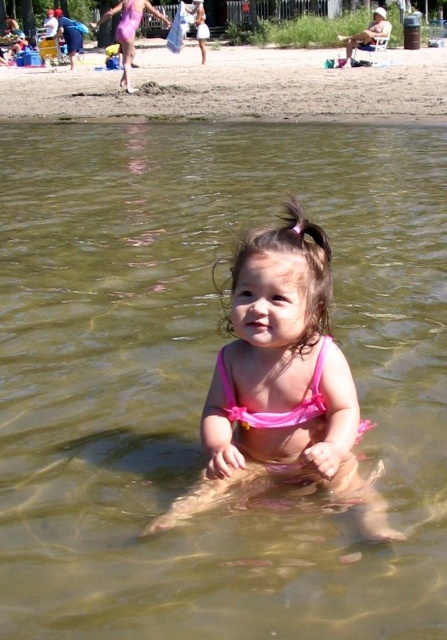
Which is below, pink fabric bikini at center or pink fabric swimsuit at center?

pink fabric swimsuit at center is lower down.

Does pink fabric bikini at center have a smaller size compared to pink fabric swimsuit at center?

Actually, pink fabric bikini at center might be larger than pink fabric swimsuit at center.

Who is more forward, (x=231, y=381) or (x=299, y=412)?

Point (x=299, y=412) is more forward.

Where is `pink fabric bikini at center`? pink fabric bikini at center is located at coordinates (281, 378).

Can you confirm if pink fabric bikini at center is positioned below brown sand at upper center?

Yes, pink fabric bikini at center is below brown sand at upper center.

Between point (312, 371) and point (154, 84), which one is positioned in front?

Point (312, 371) is in front.

The image size is (447, 640). Find the location of `pink fabric bikini at center`. pink fabric bikini at center is located at coordinates 281,378.

Who is more distant from viewer, (316, 97) or (315, 364)?

The point (316, 97) is more distant.

Which is in front, point (388, 93) or point (222, 374)?

Point (222, 374)

Does point (76, 86) come closer to viewer compared to point (282, 413)?

No, it is not.

The height and width of the screenshot is (640, 447). What are the coordinates of `brown sand at upper center` in the screenshot? It's located at (236, 86).